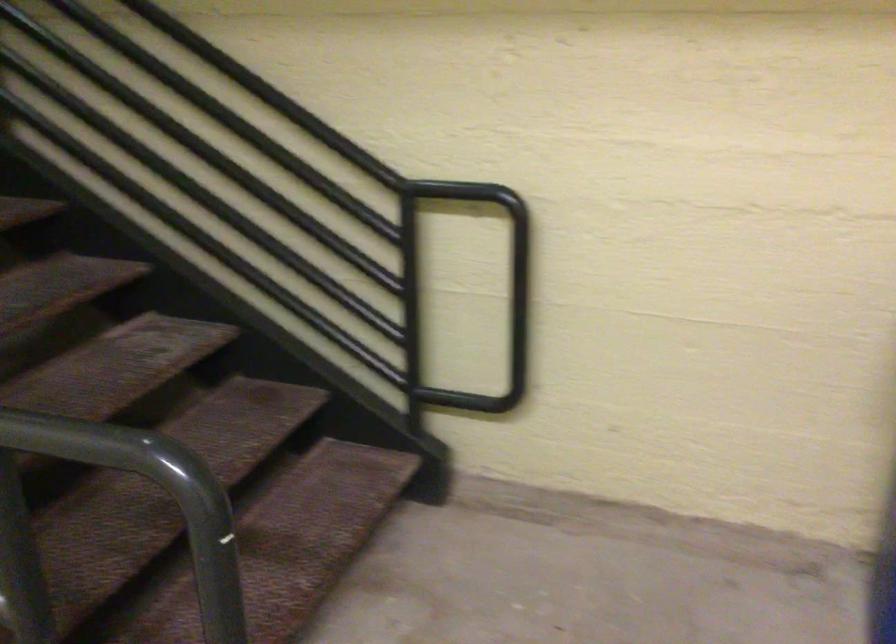
This screenshot has width=896, height=644. Find the location of `black stair railing`. black stair railing is located at coordinates (265, 91).